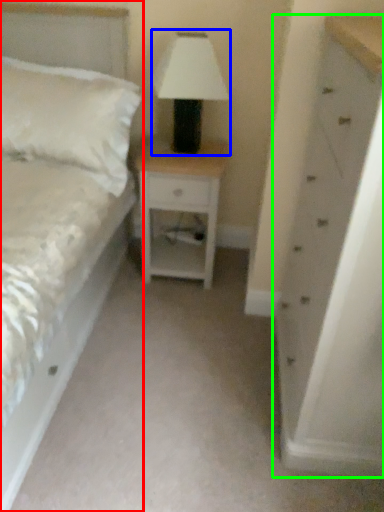
Question: Based on their relative distances, which object is farther from bed (highlighted by a red box)? Choose from table lamp (highlighted by a blue box) and chest of drawers (highlighted by a green box).

Choices:
 (A) table lamp
 (B) chest of drawers

Answer: (B)